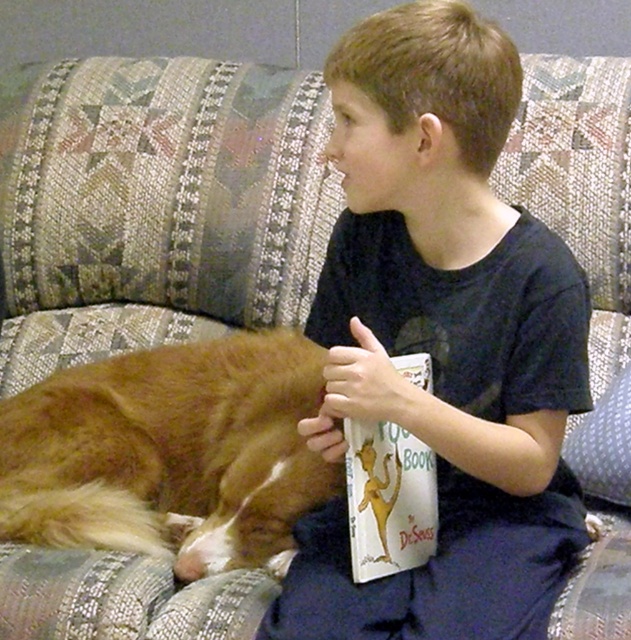
The height and width of the screenshot is (640, 631). Find the location of `dark blue cotton shirt at center`. dark blue cotton shirt at center is located at coordinates (442, 339).

Is dark blue cotton shirt at center smaller than white paper book at center?

No.

This screenshot has height=640, width=631. In order to click on dark blue cotton shirt at center in this screenshot , I will do `click(442, 339)`.

Where is `dark blue cotton shirt at center`? This screenshot has width=631, height=640. dark blue cotton shirt at center is located at coordinates (442, 339).

Does golden fur dog at lower left have a greater width compared to white paper book at center?

Yes, golden fur dog at lower left is wider than white paper book at center.

Does golden fur dog at lower left have a greater height compared to white paper book at center?

Correct, golden fur dog at lower left is much taller as white paper book at center.

Is point (309, 460) positioned after point (363, 508)?

Yes.

The width and height of the screenshot is (631, 640). Find the location of `golden fur dog at lower left`. golden fur dog at lower left is located at coordinates (170, 452).

Which is below, dark blue cotton shirt at center or golden fur dog at lower left?

golden fur dog at lower left is lower down.

You are a GUI agent. You are given a task and a screenshot of the screen. Output one action in this format:
    pyautogui.click(x=<x>, y=<y>)
    Task: Click on the dark blue cotton shirt at center
    
    Given the screenshot: What is the action you would take?
    pyautogui.click(x=442, y=339)

Image resolution: width=631 pixels, height=640 pixels. Identify the location of dark blue cotton shirt at center. (442, 339).